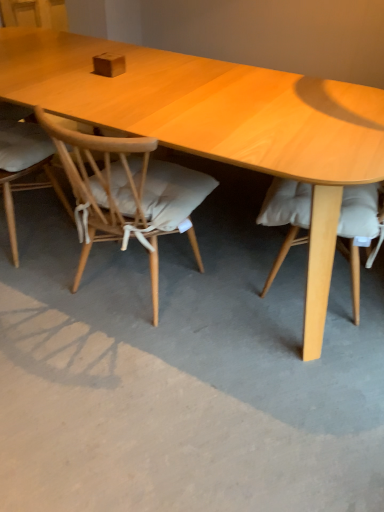
At what (x,y) coordinates should I click in order to perform the action: click on vacant area situated below light brown wood chair at left, the first chair viewed from the left (from a real-world perspective). Please return your answer as a coordinate pair (x, y). Image resolution: width=384 pixels, height=512 pixels. Looking at the image, I should click on (31, 226).